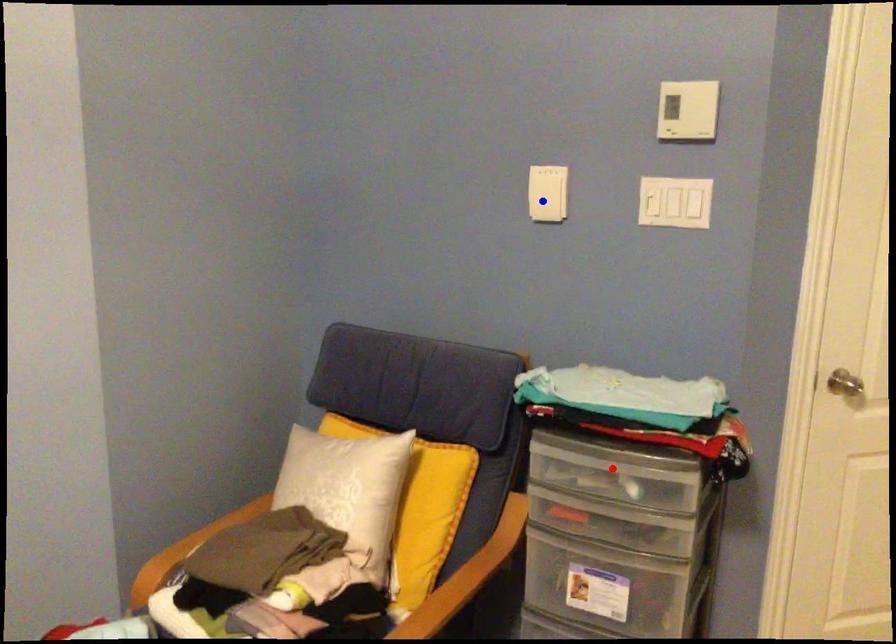
Question: In the image, two points are highlighted. Which point is nearer to the camera? Reply with the corresponding letter.

Choices:
 (A) blue point
 (B) red point

Answer: (B)